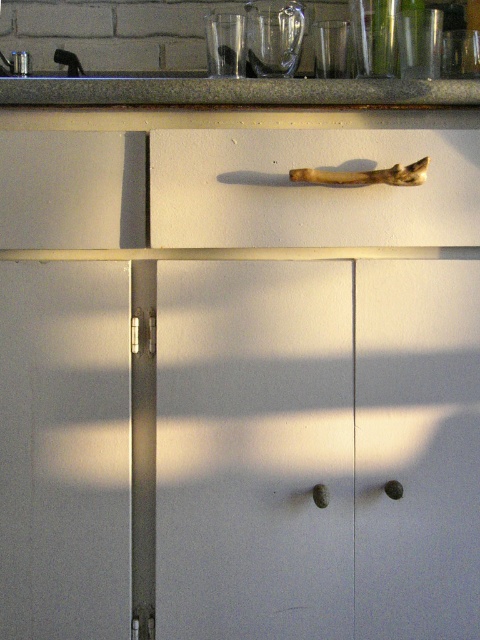
Does point (312, 205) lie behind point (176, 77)?

No, (312, 205) is in front of (176, 77).

Can you confirm if wooden handle at center is bigger than granite countertop at upper center?

Incorrect, wooden handle at center is not larger than granite countertop at upper center.

Between point (266, 148) and point (230, 93), which one is positioned in front?

Point (230, 93) is more forward.

Where is `wooden handle at center`? This screenshot has height=640, width=480. wooden handle at center is located at coordinates (311, 188).